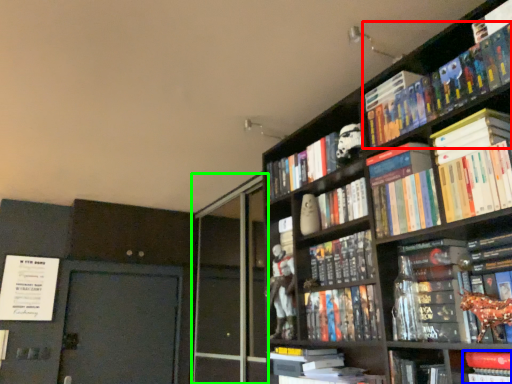
Question: Based on their relative distances, which object is nearer to book (highlighted by a red box)? Choose from book (highlighted by a blue box) and screen door (highlighted by a green box).

Choices:
 (A) book
 (B) screen door

Answer: (A)